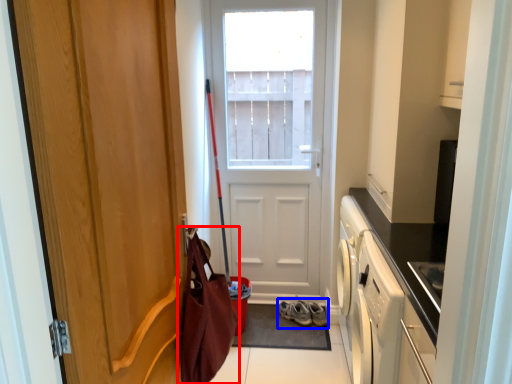
Question: Which object is closer to the camera taking this photo, messenger bag (highlighted by a red box) or footwear (highlighted by a blue box)?

Choices:
 (A) messenger bag
 (B) footwear

Answer: (A)